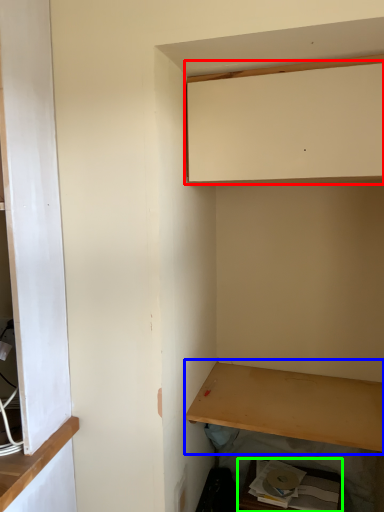
Question: Which is nearer to the cabinetry (highlighted by a red box)? shelf (highlighted by a blue box) or cabinetry (highlighted by a green box).

Choices:
 (A) shelf
 (B) cabinetry

Answer: (A)